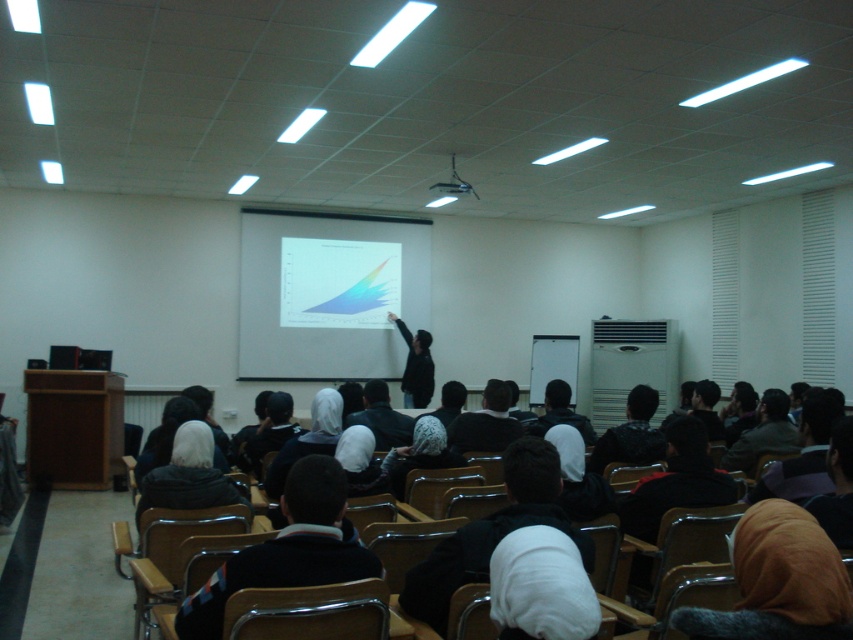
Which is above, white soft sweater at center or dark brown leather jacket at center?

white soft sweater at center

Which is behind, point (437, 584) or point (784, 413)?

The point (784, 413) is more distant.

Does point (405, 579) lie in front of point (734, 460)?

Yes, point (405, 579) is closer to viewer.

Locate an element on the screen. The width and height of the screenshot is (853, 640). white soft sweater at center is located at coordinates (492, 532).

Image resolution: width=853 pixels, height=640 pixels. What do you see at coordinates (492, 532) in the screenshot?
I see `white soft sweater at center` at bounding box center [492, 532].

Which is in front, point (532, 515) or point (190, 433)?

Point (532, 515) is more forward.

Between point (405, 611) and point (180, 440), which one is positioned in front?

Point (405, 611) is more forward.

Where is `white soft sweater at center`? The image size is (853, 640). white soft sweater at center is located at coordinates (492, 532).

Does black fabric jacket at center have a greater height compared to black fabric headscarf at center?

Yes, black fabric jacket at center is taller than black fabric headscarf at center.

Can you confirm if black fabric jacket at center is positioned below black fabric headscarf at center?

Yes.

Does point (244, 584) come farther from viewer compared to point (456, 435)?

No.

Where is `black fabric jacket at center`? black fabric jacket at center is located at coordinates (287, 548).